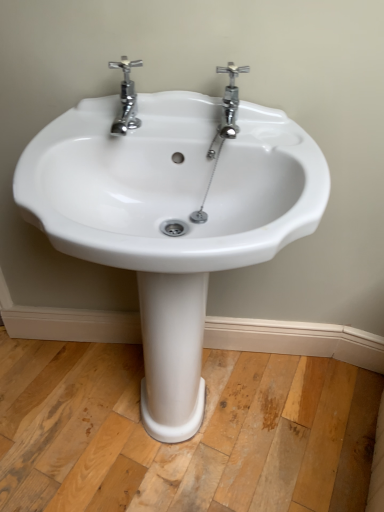
Question: Is chrome/metallic faucet at upper center, the first tap in the right-to-left sequence, at the left side of white ceramic sink at center?

Choices:
 (A) no
 (B) yes

Answer: (A)

Question: Is white ceramic sink at center at the back of chrome/metallic faucet at upper center, the first tap in the right-to-left sequence?

Choices:
 (A) yes
 (B) no

Answer: (B)

Question: From the image's perspective, is chrome/metallic faucet at upper center, the first tap in the right-to-left sequence, on top of white ceramic sink at center?

Choices:
 (A) no
 (B) yes

Answer: (B)

Question: Does chrome/metallic faucet at upper center, the first tap in the right-to-left sequence, have a larger size compared to white ceramic sink at center?

Choices:
 (A) yes
 (B) no

Answer: (B)

Question: Is chrome/metallic faucet at upper center, the first tap in the right-to-left sequence, outside white ceramic sink at center?

Choices:
 (A) no
 (B) yes

Answer: (A)

Question: Is chrome/metallic faucet at upper center, marked as the 2th tap in a left-to-right arrangement, to the right of white ceramic sink at center from the viewer's perspective?

Choices:
 (A) no
 (B) yes

Answer: (B)

Question: Is white ceramic sink at center touching chrome/metallic faucet at upper center, marked as the 2th tap in a left-to-right arrangement?

Choices:
 (A) yes
 (B) no

Answer: (B)

Question: From the image's perspective, is white ceramic sink at center under chrome/metallic faucet at upper center, the first tap in the right-to-left sequence?

Choices:
 (A) no
 (B) yes

Answer: (B)

Question: Is white ceramic sink at center outside chrome/metallic faucet at upper center, the first tap in the right-to-left sequence?

Choices:
 (A) yes
 (B) no

Answer: (A)

Question: Is white ceramic sink at center surrounding chrome/metallic faucet at upper center, marked as the 2th tap in a left-to-right arrangement?

Choices:
 (A) no
 (B) yes

Answer: (B)

Question: From a real-world perspective, is white ceramic sink at center on chrome/metallic faucet at upper center, the first tap in the right-to-left sequence?

Choices:
 (A) yes
 (B) no

Answer: (B)

Question: From the image's perspective, is white ceramic sink at center located above chrome/metallic faucet at upper center, marked as the 2th tap in a left-to-right arrangement?

Choices:
 (A) no
 (B) yes

Answer: (A)

Question: Is the depth of chrome/metallic faucet at upper center, the first tap in the right-to-left sequence, greater than that of chrome/metallic faucet at upper left, positioned as the second tap in right-to-left order?

Choices:
 (A) yes
 (B) no

Answer: (A)